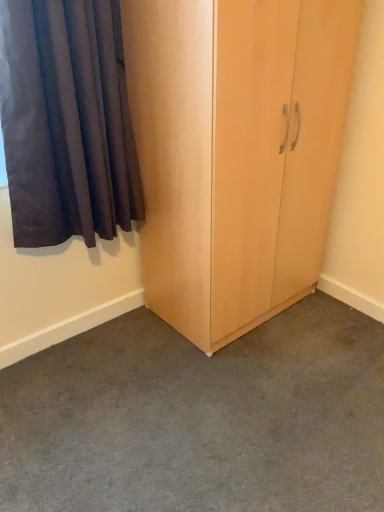
Question: Is dark blue fabric curtain at left wider or thinner than carpeted floor at center?

Choices:
 (A) thin
 (B) wide

Answer: (A)

Question: Is dark blue fabric curtain at left bigger or smaller than carpeted floor at center?

Choices:
 (A) small
 (B) big

Answer: (A)

Question: Which object is the closest to the dark blue fabric curtain at left?

Choices:
 (A) light wood cupboard at center
 (B) carpeted floor at center

Answer: (A)

Question: Which of these objects is positioned closest to the carpeted floor at center?

Choices:
 (A) light wood cupboard at center
 (B) dark blue fabric curtain at left

Answer: (A)